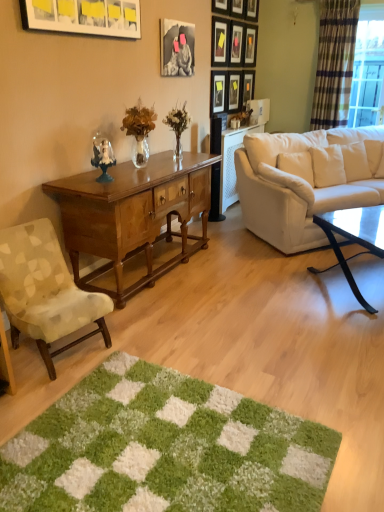
I want to click on empty space that is to the right of light brown wood desk at center, so click(253, 280).